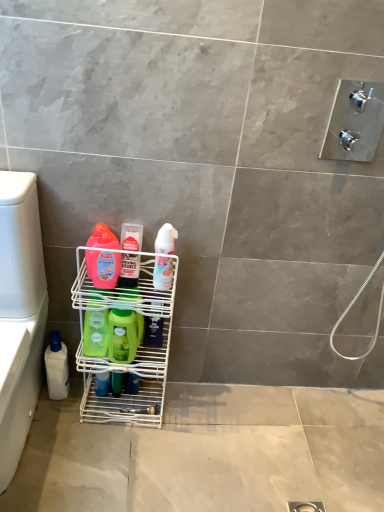
Question: Is green matte bottle at center, arranged as the sixth cleaning product when viewed from the right, positioned far away from green matte bottle at center, positioned as the 2th cleaning product in right-to-left order?

Choices:
 (A) no
 (B) yes

Answer: (A)

Question: Is green matte bottle at center, which ranks as the 2th cleaning product in left-to-right order, closer to the viewer compared to green matte bottle at center, positioned as the 2th cleaning product in right-to-left order?

Choices:
 (A) yes
 (B) no

Answer: (A)

Question: Does green matte bottle at center, arranged as the sixth cleaning product when viewed from the right, have a lesser width compared to green matte bottle at center, positioned as the 2th cleaning product in right-to-left order?

Choices:
 (A) no
 (B) yes

Answer: (A)

Question: Does green matte bottle at center, which ranks as the 2th cleaning product in left-to-right order, come behind green matte bottle at center, which is counted as the 6th cleaning product, starting from the left?

Choices:
 (A) yes
 (B) no

Answer: (B)

Question: Is green matte bottle at center, which ranks as the 2th cleaning product in left-to-right order, outside green matte bottle at center, which is counted as the 6th cleaning product, starting from the left?

Choices:
 (A) yes
 (B) no

Answer: (A)

Question: Does green matte bottle at center, which ranks as the 2th cleaning product in left-to-right order, have a larger size compared to green matte bottle at center, positioned as the 2th cleaning product in right-to-left order?

Choices:
 (A) yes
 (B) no

Answer: (A)

Question: Is green matte bottle at center, the fourth cleaning product in the right-to-left sequence, next to white plastic bottle at lower left, positioned as the first cleaning product in left-to-right order?

Choices:
 (A) yes
 (B) no

Answer: (B)

Question: Is white plastic bottle at lower left, positioned as the first cleaning product in left-to-right order, completely or partially inside green matte bottle at center, the fourth cleaning product in the right-to-left sequence?

Choices:
 (A) no
 (B) yes

Answer: (A)

Question: Does green matte bottle at center, the fourth cleaning product from the left, have a greater width compared to white plastic bottle at lower left, positioned as the first cleaning product in left-to-right order?

Choices:
 (A) no
 (B) yes

Answer: (A)

Question: From a real-world perspective, is green matte bottle at center, the fourth cleaning product from the left, physically below white plastic bottle at lower left, positioned as the first cleaning product in left-to-right order?

Choices:
 (A) yes
 (B) no

Answer: (B)

Question: Is green matte bottle at center, the fourth cleaning product in the right-to-left sequence, bigger than white plastic bottle at lower left, positioned as the first cleaning product in left-to-right order?

Choices:
 (A) no
 (B) yes

Answer: (A)

Question: Can you confirm if green matte bottle at center, the fourth cleaning product in the right-to-left sequence, is positioned to the left of white plastic bottle at lower left, positioned as the first cleaning product in left-to-right order?

Choices:
 (A) yes
 (B) no

Answer: (B)

Question: Is green matte bottle at center, the fourth cleaning product in the right-to-left sequence, behind white wire rack at lower left?

Choices:
 (A) no
 (B) yes

Answer: (B)